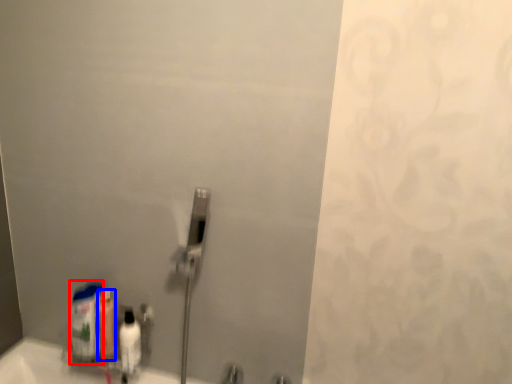
Question: Which point is further to the camera, cleaning product (highlighted by a red box) or mouthwash (highlighted by a blue box)?

Choices:
 (A) cleaning product
 (B) mouthwash

Answer: (B)